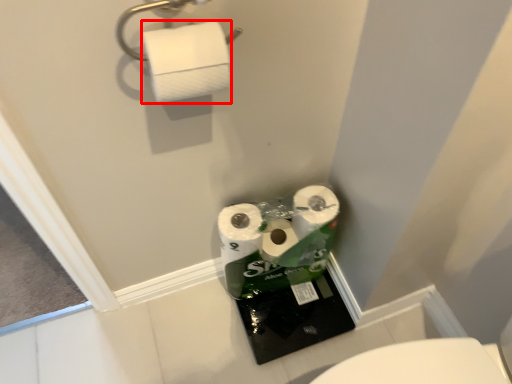
Question: Considering the relative positions of toilet paper (annotated by the red box) and towel bar in the image provided, where is toilet paper (annotated by the red box) located with respect to the staircase?

Choices:
 (A) left
 (B) right

Answer: (B)